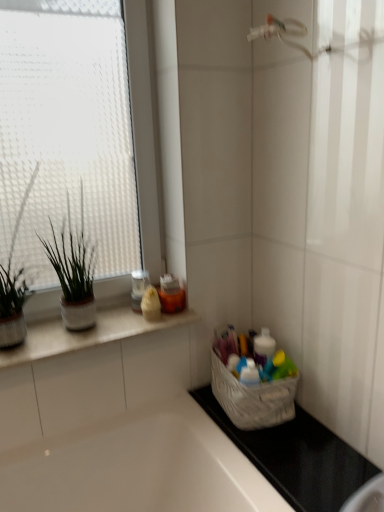
You are a GUI agent. You are given a task and a screenshot of the screen. Output one action in this format:
    pyautogui.click(x=<x>, y=<y>)
    Task: Click on the free region under green matte plant at left, which is counted as the 1th houseplant, starting from the left (from a real-world perspective)
    
    Given the screenshot: What is the action you would take?
    pyautogui.click(x=29, y=343)